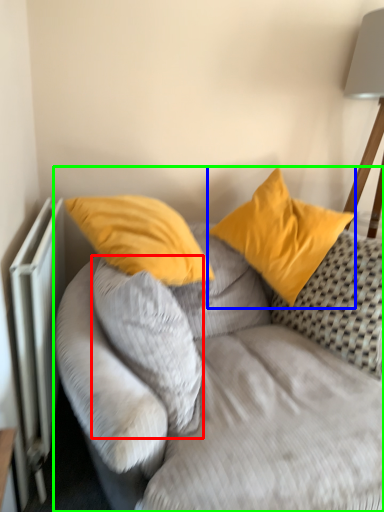
Question: Which object is positioned farthest from pillow (highlighted by a red box)? Select from pillow (highlighted by a blue box) and studio couch (highlighted by a green box).

Choices:
 (A) pillow
 (B) studio couch

Answer: (A)